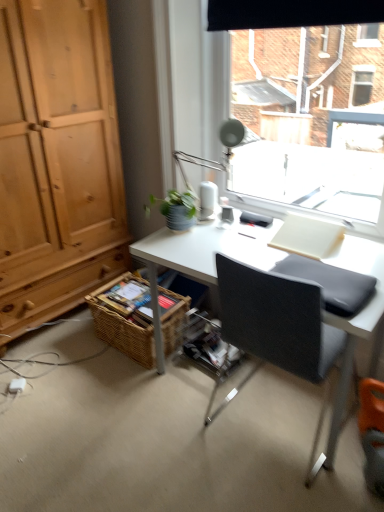
Question: Is black fabric chair at center surrounding woven brown basket at lower left?

Choices:
 (A) no
 (B) yes

Answer: (A)

Question: Are black fabric chair at center and woven brown basket at lower left making contact?

Choices:
 (A) yes
 (B) no

Answer: (B)

Question: From the image's perspective, would you say black fabric chair at center is shown under woven brown basket at lower left?

Choices:
 (A) yes
 (B) no

Answer: (B)

Question: Considering the relative positions of black fabric chair at center and woven brown basket at lower left in the image provided, is black fabric chair at center in front of woven brown basket at lower left?

Choices:
 (A) no
 (B) yes

Answer: (B)

Question: Is black fabric chair at center oriented away from woven brown basket at lower left?

Choices:
 (A) no
 (B) yes

Answer: (A)

Question: Would you say green matte plant at upper center is inside or outside black fabric chair at center?

Choices:
 (A) outside
 (B) inside

Answer: (A)

Question: From the image's perspective, is green matte plant at upper center located above or below black fabric chair at center?

Choices:
 (A) above
 (B) below

Answer: (A)

Question: Considering the positions of point (180, 202) and point (322, 337), is point (180, 202) closer or farther from the camera than point (322, 337)?

Choices:
 (A) farther
 (B) closer

Answer: (A)

Question: In the image, is green matte plant at upper center on the left side or the right side of black fabric chair at center?

Choices:
 (A) right
 (B) left

Answer: (B)

Question: Based on their sizes in the image, would you say woven brown basket at lower left is bigger or smaller than matte silver table lamp at upper center?

Choices:
 (A) small
 (B) big

Answer: (B)

Question: From the image's perspective, is woven brown basket at lower left above or below matte silver table lamp at upper center?

Choices:
 (A) below
 (B) above

Answer: (A)

Question: Considering the positions of woven brown basket at lower left and matte silver table lamp at upper center in the image, is woven brown basket at lower left taller or shorter than matte silver table lamp at upper center?

Choices:
 (A) short
 (B) tall

Answer: (A)

Question: Is woven brown basket at lower left in front of or behind matte silver table lamp at upper center in the image?

Choices:
 (A) behind
 (B) front

Answer: (A)

Question: Considering their positions, is woven brown basket at lower left located in front of or behind green matte plant at upper center?

Choices:
 (A) behind
 (B) front

Answer: (A)

Question: In terms of height, does woven brown basket at lower left look taller or shorter compared to green matte plant at upper center?

Choices:
 (A) short
 (B) tall

Answer: (B)